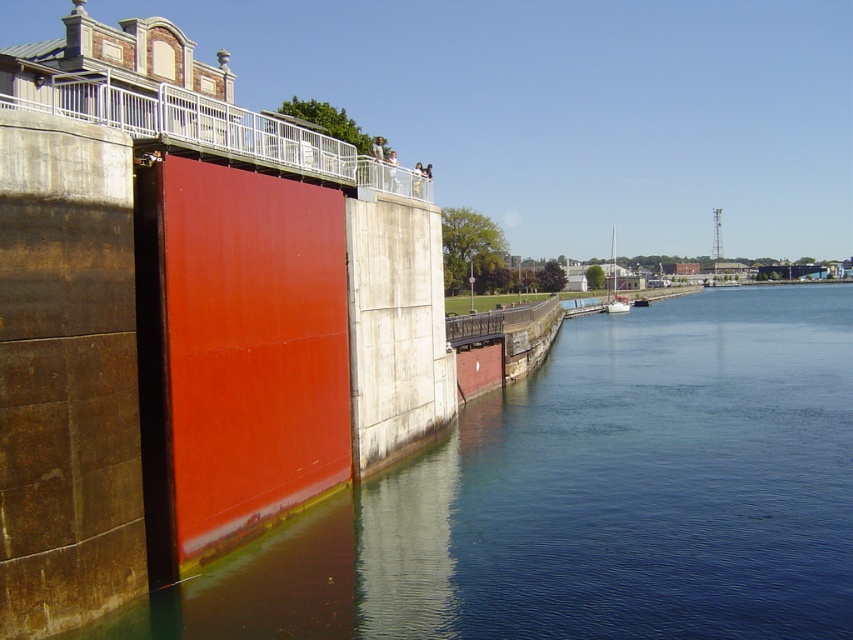
You are a maintenance worker tasked with inspecting the lock system. You need to locate the smooth concrete wall at left. According to the coordinates provided, where exactly should you look for it?

The smooth concrete wall at left is located at coordinates point (585,497).